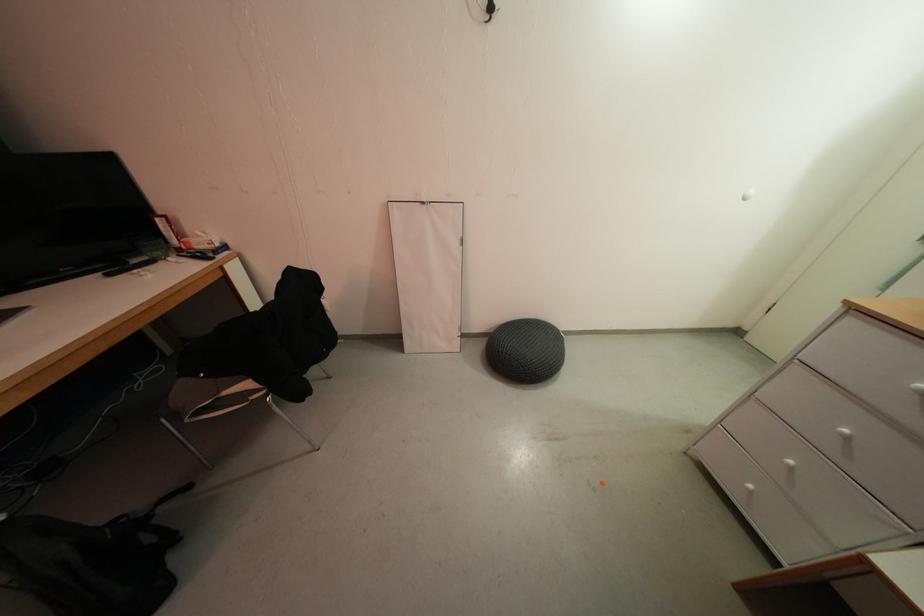
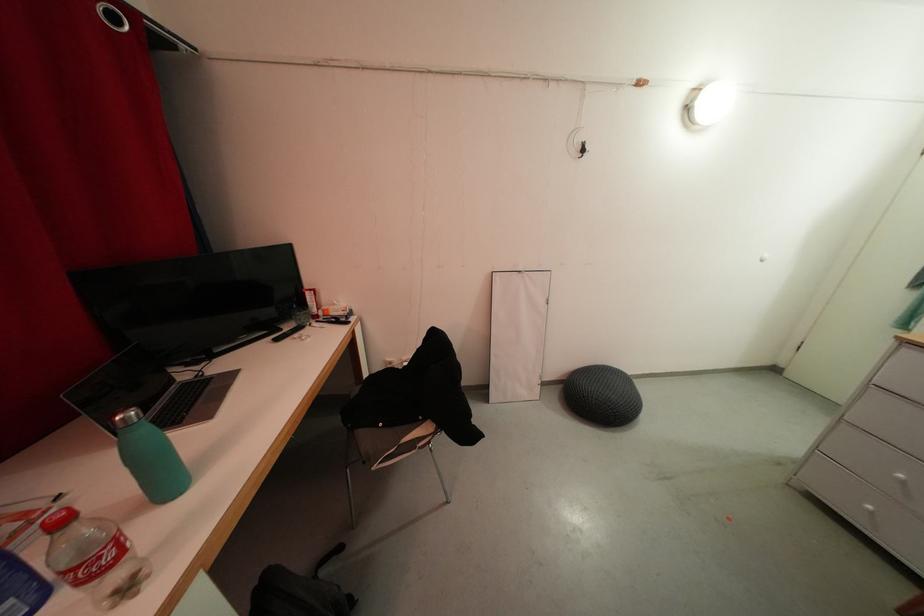
Where in the second image is the point corresponding to (x=757, y=490) from the first image?

(874, 511)